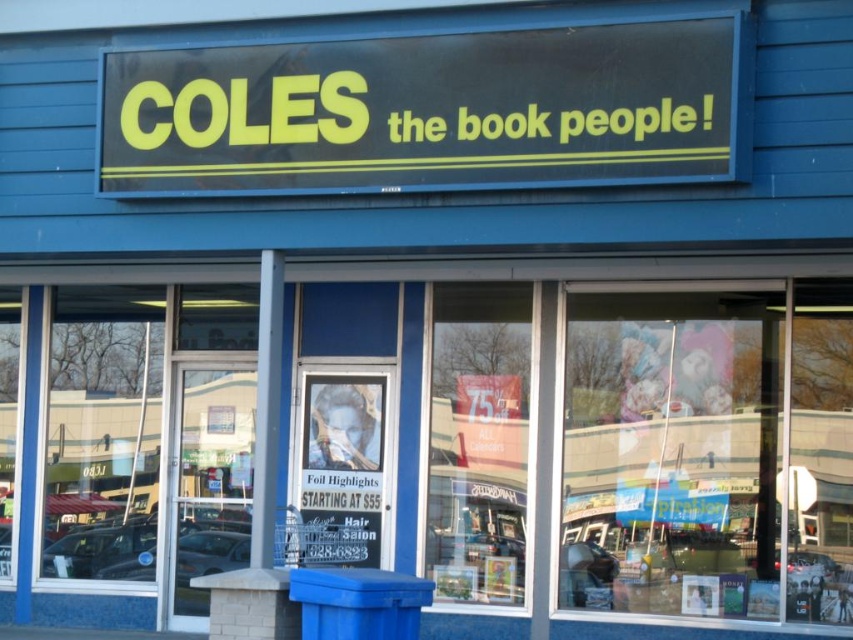
Question: Is transparent glass window at center positioned at the back of metallic poster at center?

Choices:
 (A) yes
 (B) no

Answer: (A)

Question: Can you confirm if transparent glass window at center is wider than metallic poster at center?

Choices:
 (A) no
 (B) yes

Answer: (B)

Question: In this image, where is transparent glass window at center located relative to metallic poster at center?

Choices:
 (A) below
 (B) above

Answer: (B)

Question: Which point is closer to the camera taking this photo?

Choices:
 (A) 511,316
 (B) 309,477

Answer: (A)